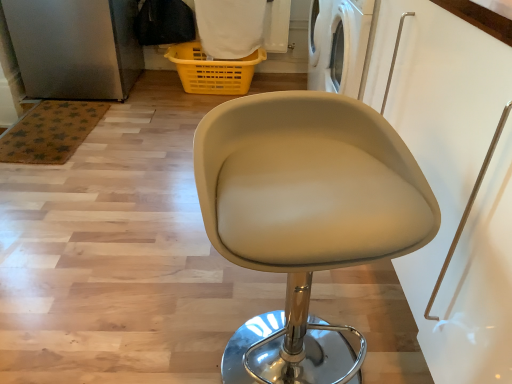
This screenshot has height=384, width=512. What are the coordinates of `beige leather stool at center` in the screenshot? It's located at (305, 217).

Describe the element at coordinates (305, 217) in the screenshot. I see `beige leather stool at center` at that location.

What do you see at coordinates (213, 70) in the screenshot? The width and height of the screenshot is (512, 384). I see `yellow plastic basket at upper center` at bounding box center [213, 70].

The height and width of the screenshot is (384, 512). In order to click on yellow plastic basket at upper center in this screenshot , I will do `click(213, 70)`.

Locate an element on the screen. The width and height of the screenshot is (512, 384). beige leather stool at center is located at coordinates (305, 217).

Visually, is yellow plastic basket at upper center positioned to the left or to the right of beige leather stool at center?

yellow plastic basket at upper center is positioned on beige leather stool at center's left side.

Considering their positions, is yellow plastic basket at upper center located in front of or behind beige leather stool at center?

yellow plastic basket at upper center is behind beige leather stool at center.

Which is less distant, (237,75) or (306,214)?

The point (306,214) is closer to the camera.

From the image's perspective, is yellow plastic basket at upper center on top of beige leather stool at center?

Yes, from the image's perspective, yellow plastic basket at upper center is above beige leather stool at center.

Based on the photo, from a real-world perspective, is yellow plastic basket at upper center located higher than beige leather stool at center?

No, from a real-world perspective, yellow plastic basket at upper center is not over beige leather stool at center

Considering the relative sizes of yellow plastic basket at upper center and beige leather stool at center in the image provided, is yellow plastic basket at upper center thinner than beige leather stool at center?

Yes, yellow plastic basket at upper center is thinner than beige leather stool at center.

Does yellow plastic basket at upper center have a lesser height compared to beige leather stool at center?

Indeed, yellow plastic basket at upper center has a lesser height compared to beige leather stool at center.

Considering the sizes of yellow plastic basket at upper center and beige leather stool at center in the image, is yellow plastic basket at upper center bigger or smaller than beige leather stool at center?

In the image, yellow plastic basket at upper center appears to be smaller than beige leather stool at center.

Is yellow plastic basket at upper center spatially inside beige leather stool at center, or outside of it?

yellow plastic basket at upper center exists outside the volume of beige leather stool at center.

Are yellow plastic basket at upper center and beige leather stool at center making contact?

There is a gap between yellow plastic basket at upper center and beige leather stool at center.

From the picture: Is yellow plastic basket at upper center turned away from beige leather stool at center?

No.

How far apart are yellow plastic basket at upper center and beige leather stool at center?

yellow plastic basket at upper center is 1.94 meters away from beige leather stool at center.

You are a GUI agent. You are given a task and a screenshot of the screen. Output one action in this format:
    pyautogui.click(x=<x>, y=<y>)
    Task: Click on the chair located above the yellow plastic basket at upper center (from a real-world perspective)
    The image size is (512, 384).
    Given the screenshot: What is the action you would take?
    pyautogui.click(x=305, y=217)

Between beige leather stool at center and yellow plastic basket at upper center, which one appears on the left side from the viewer's perspective?

yellow plastic basket at upper center is more to the left.

Considering the relative positions of beige leather stool at center and yellow plastic basket at upper center in the image provided, is beige leather stool at center behind yellow plastic basket at upper center?

No.

Which is in front, point (306, 282) or point (229, 83)?

The point (306, 282) is closer.

From the image's perspective, is beige leather stool at center positioned above or below yellow plastic basket at upper center?

From the image's perspective, beige leather stool at center appears below yellow plastic basket at upper center.

From a real-world perspective, which object rests below the other?

In real-world perspective, yellow plastic basket at upper center is lower.

Looking at their sizes, would you say beige leather stool at center is wider or thinner than yellow plastic basket at upper center?

beige leather stool at center is wider than yellow plastic basket at upper center.

Which of these two, beige leather stool at center or yellow plastic basket at upper center, stands taller?

With more height is beige leather stool at center.

Consider the image. Who is bigger, beige leather stool at center or yellow plastic basket at upper center?

beige leather stool at center.

Would you say beige leather stool at center contains yellow plastic basket at upper center?

Actually, yellow plastic basket at upper center is outside beige leather stool at center.

Are beige leather stool at center and yellow plastic basket at upper center making contact?

No, beige leather stool at center is not beside yellow plastic basket at upper center.

Is yellow plastic basket at upper center at the back of beige leather stool at center?

Absolutely, beige leather stool at center is directed away from yellow plastic basket at upper center.

From the picture: How many degrees apart are the facing directions of beige leather stool at center and yellow plastic basket at upper center?

beige leather stool at center and yellow plastic basket at upper center are facing 10.8 degrees away from each other.

In the image, there is a yellow plastic basket at upper center. What are the coordinates of `chair below it (from the image's perspective)` in the screenshot? It's located at (305, 217).

Identify the location of chair that appears above the yellow plastic basket at upper center (from a real-world perspective). This screenshot has width=512, height=384. (305, 217).

At what (x,y) coordinates should I click in order to perform the action: click on chair that is in front of the yellow plastic basket at upper center. Please return your answer as a coordinate pair (x, y). Looking at the image, I should click on (305, 217).